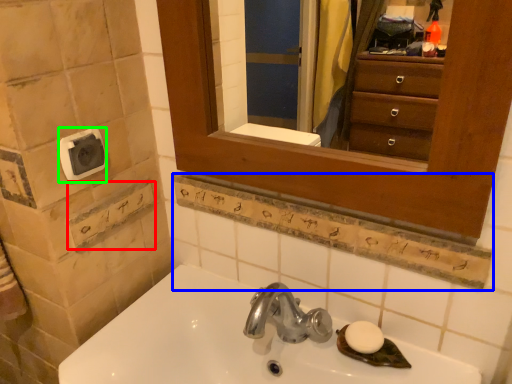
Question: Based on their relative distances, which object is nearer to square (highlighted by a red box)? Choose from ledge (highlighted by a blue box) and towel bar (highlighted by a green box).

Choices:
 (A) ledge
 (B) towel bar

Answer: (B)